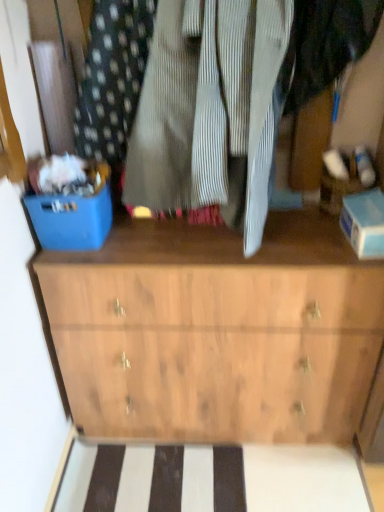
Question: Can blue plastic bin at left be found inside wooden chest of drawers at center?

Choices:
 (A) yes
 (B) no

Answer: (B)

Question: Is wooden chest of drawers at center to the right of blue plastic bin at left from the viewer's perspective?

Choices:
 (A) no
 (B) yes

Answer: (B)

Question: Is wooden chest of drawers at center in front of blue plastic bin at left?

Choices:
 (A) yes
 (B) no

Answer: (B)

Question: Does wooden chest of drawers at center touch blue plastic bin at left?

Choices:
 (A) yes
 (B) no

Answer: (B)

Question: Is wooden chest of drawers at center bigger than blue plastic bin at left?

Choices:
 (A) no
 (B) yes

Answer: (B)

Question: From a real-world perspective, is wooden chest of drawers at center under blue plastic bin at left?

Choices:
 (A) yes
 (B) no

Answer: (A)

Question: From the image's perspective, does blue plastic bin at left appear higher than wooden chest of drawers at center?

Choices:
 (A) no
 (B) yes

Answer: (B)

Question: Considering the relative positions of blue plastic bin at left and wooden chest of drawers at center in the image provided, is blue plastic bin at left to the right of wooden chest of drawers at center from the viewer's perspective?

Choices:
 (A) yes
 (B) no

Answer: (B)

Question: Is the depth of blue plastic bin at left less than that of wooden chest of drawers at center?

Choices:
 (A) yes
 (B) no

Answer: (A)

Question: Is blue plastic bin at left taller than wooden chest of drawers at center?

Choices:
 (A) no
 (B) yes

Answer: (A)

Question: From a real-world perspective, does blue plastic bin at left sit lower than wooden chest of drawers at center?

Choices:
 (A) no
 (B) yes

Answer: (A)

Question: Considering the relative sizes of blue plastic bin at left and wooden chest of drawers at center in the image provided, is blue plastic bin at left thinner than wooden chest of drawers at center?

Choices:
 (A) no
 (B) yes

Answer: (B)

Question: From their relative heights in the image, would you say blue plastic bin at left is taller or shorter than wooden chest of drawers at center?

Choices:
 (A) short
 (B) tall

Answer: (A)